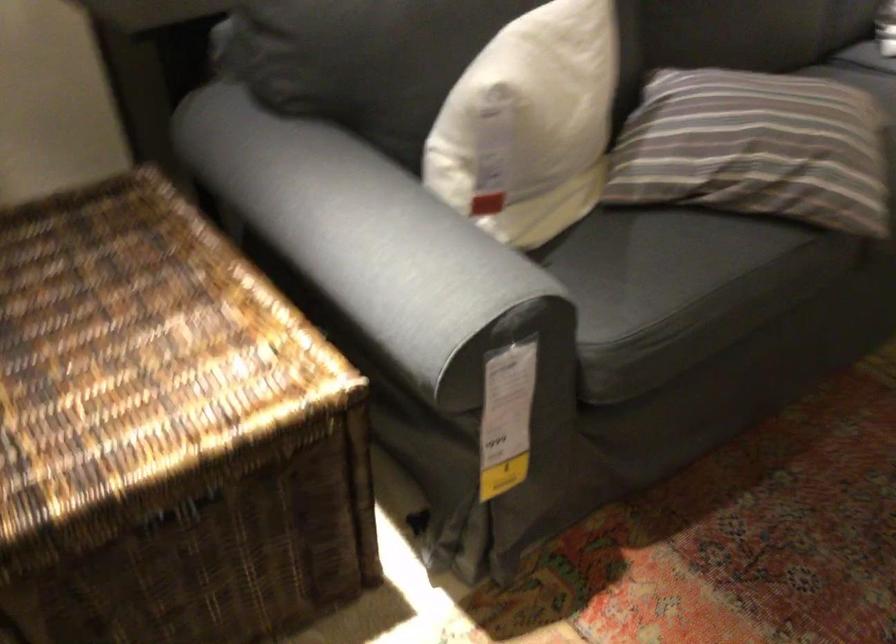
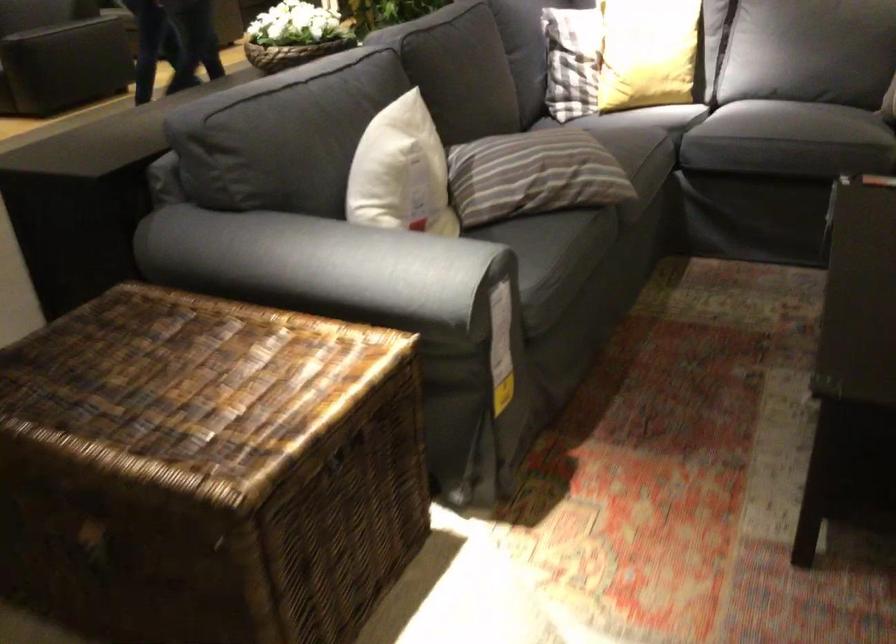
Locate, in the second image, the point that corresponds to the point at 479,118 in the first image.

(401, 172)